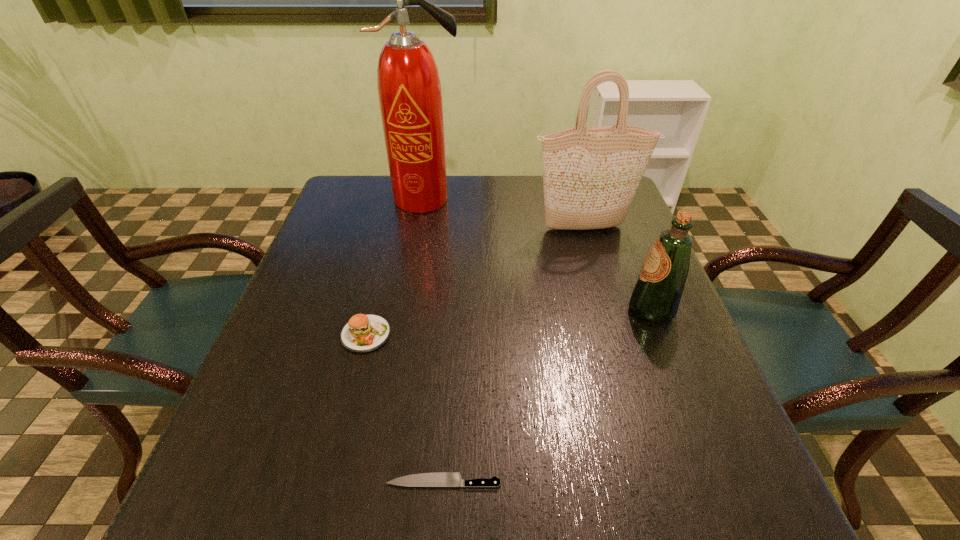
Locate an element on the screen. This screenshot has height=540, width=960. the farthest object is located at coordinates (409, 89).

This screenshot has width=960, height=540. I want to click on the tallest object, so click(409, 89).

You are a GUI agent. You are given a task and a screenshot of the screen. Output one action in this format:
    pyautogui.click(x=<x>, y=<y>)
    Task: Click on the shopping bag
    The height and width of the screenshot is (540, 960).
    Given the screenshot: What is the action you would take?
    pyautogui.click(x=590, y=174)

Locate an element on the screen. the fourth nearest object is located at coordinates (590, 174).

Identify the location of olive oil. (656, 295).

Identify the location of the second shortest object. (363, 333).

I want to click on the nearest object, so click(434, 479).

Find the location of a particular element. the shortest object is located at coordinates (434, 479).

The height and width of the screenshot is (540, 960). Find the location of `free spot located on the front of the fire extinguisher`. free spot located on the front of the fire extinguisher is located at coordinates (416, 251).

Locate an element on the screen. The height and width of the screenshot is (540, 960). vacant space situated 0.170m on the back of the shopping bag is located at coordinates (573, 188).